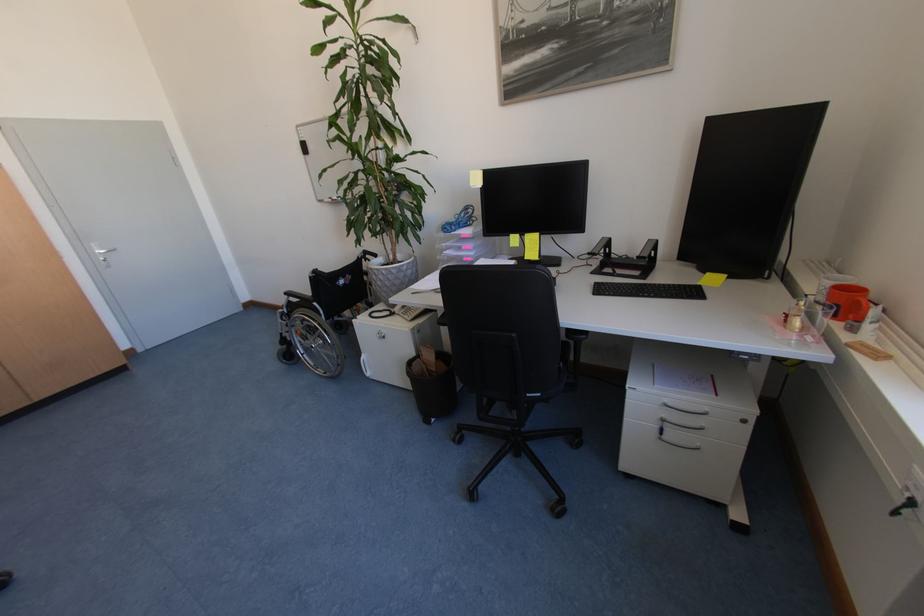
At what (x,y) coordinates should I click in order to perform the action: click on door handle. Please return your answer as a coordinate pair (x, y). The image size is (924, 616). Looking at the image, I should click on (102, 252).